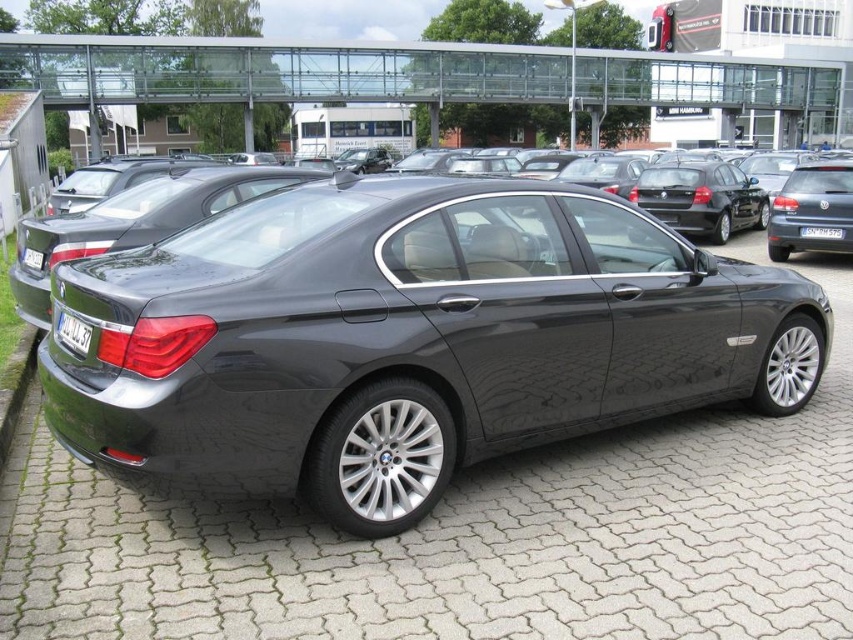
You are a photographer trying to capture the white plastic license plate at rear of the satin black sedan at center. Since the sedan is blocking the license plate, can you move the car to the left to get a clear shot? Explain your reasoning based on their positions.

The satin black sedan at center is to the right of the white plastic license plate at rear, so moving the sedan to the left would place it further away from the license plate, allowing you to capture the license plate without obstruction.

You are a delivery person who needs to place a new license plate on the satin black sedan at center. The current white plastic license plate at center is already installed. Can you determine if the new license plate will fit without needing to remove the existing one?

The satin black sedan at center is larger in size than the white plastic license plate at center, so there should be enough space to place the new license plate without removing the existing one.